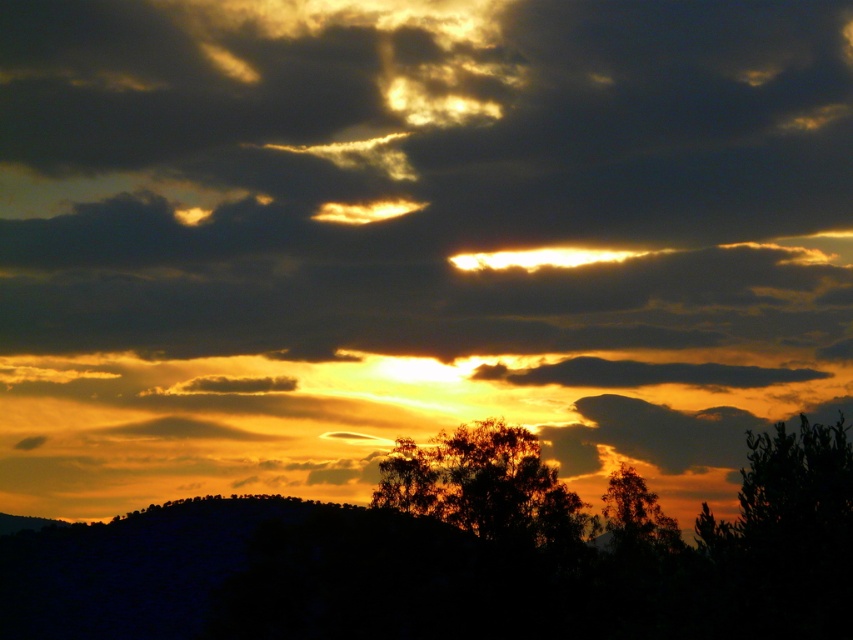
Based on the photo, you are an artist trying to paint this sunset scene. You want to place the silhouetted foliage at center and the dark green leafy tree at right in your painting. Based on the scene, which object should you paint first to ensure proper layering?

The silhouetted foliage at center should be painted first because it is closer to the viewer than the dark green leafy tree at right, so it should be layered over the tree in the background.

Looking at this image, you are standing in the foreground of the sunset scene and want to walk from the dark green leafy tree at right to the dark green leafy tree at lower right. Which direction should you move?

You should move to the right because the dark green leafy tree at lower right is positioned to the right of the dark green leafy tree at right.